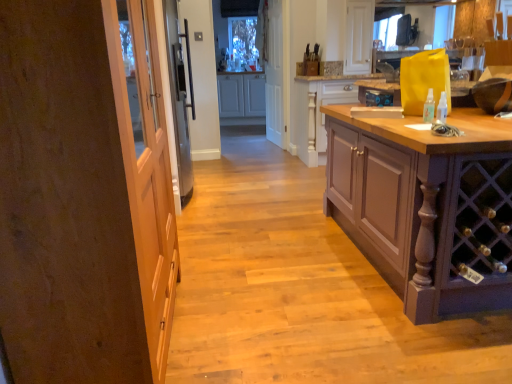
Question: Does clear plastic spray bottle at right come in front of white matte cabinet at center, the first cabinetry when ordered from back to front?

Choices:
 (A) yes
 (B) no

Answer: (A)

Question: Considering the relative sizes of clear plastic spray bottle at right and white matte cabinet at center, the first cabinetry when ordered from back to front, in the image provided, is clear plastic spray bottle at right shorter than white matte cabinet at center, the first cabinetry when ordered from back to front,?

Choices:
 (A) yes
 (B) no

Answer: (A)

Question: Is white matte cabinet at center, the third cabinetry positioned from the front, a part of clear plastic spray bottle at right?

Choices:
 (A) yes
 (B) no

Answer: (B)

Question: From a real-world perspective, is clear plastic spray bottle at right beneath white matte cabinet at center, the first cabinetry when ordered from back to front?

Choices:
 (A) yes
 (B) no

Answer: (B)

Question: From the image's perspective, is clear plastic spray bottle at right on top of white matte cabinet at center, the first cabinetry when ordered from back to front?

Choices:
 (A) yes
 (B) no

Answer: (B)

Question: From the image's perspective, relative to pale wood cabinet at center, which is counted as the second cabinetry, starting from the back, is white matte screen door at center above or below?

Choices:
 (A) below
 (B) above

Answer: (B)

Question: Relative to pale wood cabinet at center, the 2th cabinetry viewed from the front, is white matte screen door at center in front or behind?

Choices:
 (A) front
 (B) behind

Answer: (B)

Question: From their relative heights in the image, would you say white matte screen door at center is taller or shorter than pale wood cabinet at center, the 2th cabinetry viewed from the front?

Choices:
 (A) tall
 (B) short

Answer: (A)

Question: Is point (287, 72) closer or farther from the camera than point (317, 82)?

Choices:
 (A) closer
 (B) farther

Answer: (B)

Question: Relative to clear plastic spray bottle at right, is wooden door at left in front or behind?

Choices:
 (A) front
 (B) behind

Answer: (A)

Question: Is wooden door at left wider or thinner than clear plastic spray bottle at right?

Choices:
 (A) wide
 (B) thin

Answer: (A)

Question: From the image's perspective, is wooden door at left positioned above or below clear plastic spray bottle at right?

Choices:
 (A) below
 (B) above

Answer: (A)

Question: Is wooden door at left taller or shorter than clear plastic spray bottle at right?

Choices:
 (A) tall
 (B) short

Answer: (A)

Question: Based on their positions, is pale wood cabinet at center, which is counted as the second cabinetry, starting from the back, located to the left or right of white matte screen door at center?

Choices:
 (A) right
 (B) left

Answer: (A)

Question: Would you say pale wood cabinet at center, the 2th cabinetry viewed from the front, is inside or outside white matte screen door at center?

Choices:
 (A) outside
 (B) inside

Answer: (A)